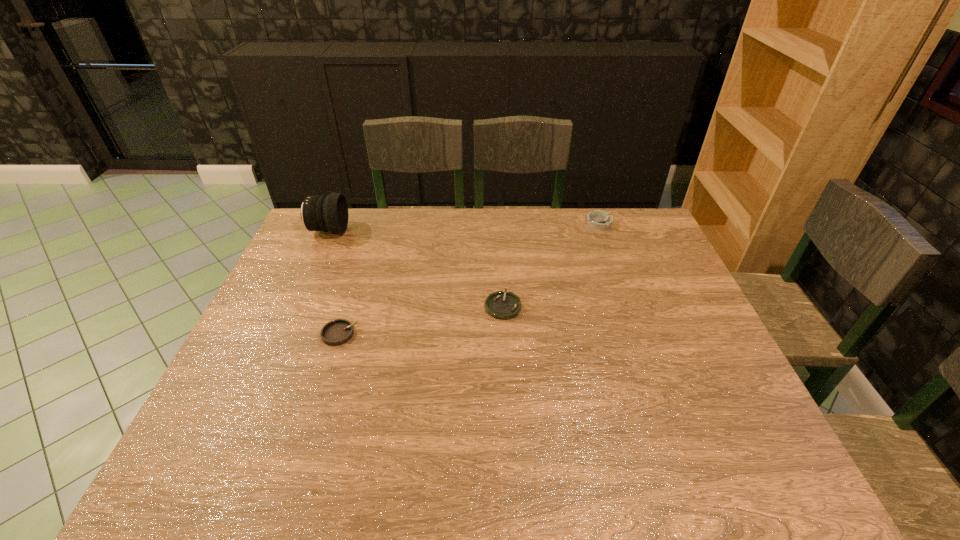
This screenshot has width=960, height=540. I want to click on vacant space situated on the right of the third tallest object, so click(x=489, y=334).

Identify the location of vacant space located on the right of the shortest object. Image resolution: width=960 pixels, height=540 pixels. (546, 306).

Find the location of a particular element. The image size is (960, 540). telephoto lens located in the far edge section of the desktop is located at coordinates (329, 213).

Locate an element on the screen. This screenshot has width=960, height=540. ashtray that is at the far edge is located at coordinates (600, 220).

At what (x,y) coordinates should I click in order to perform the action: click on object that is at the left edge. Please return your answer as a coordinate pair (x, y). Looking at the image, I should click on (329, 213).

Find the location of a particular element. Image resolution: width=960 pixels, height=540 pixels. object at the right edge is located at coordinates (600, 220).

Locate an element on the screen. object present at the far left corner is located at coordinates (329, 213).

Identify the location of object that is at the far right corner. (600, 220).

Where is `free region at the far edge`? free region at the far edge is located at coordinates (521, 239).

Where is `vacant area at the near edge of the desktop`? vacant area at the near edge of the desktop is located at coordinates (287, 480).